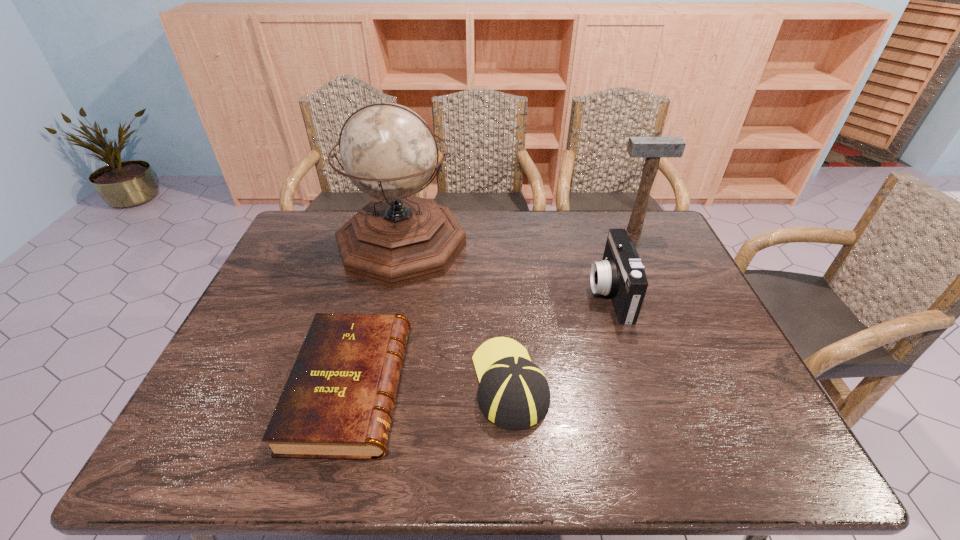
Locate an element on the screen. The image size is (960, 540). hardback book at the near edge is located at coordinates (337, 403).

You are a GUI agent. You are given a task and a screenshot of the screen. Output one action in this format:
    pyautogui.click(x=<x>, y=<y>)
    Task: Click on the object that is at the right edge
    
    Given the screenshot: What is the action you would take?
    pyautogui.click(x=652, y=148)

You are a GUI agent. You are given a task and a screenshot of the screen. Output one action in this format:
    pyautogui.click(x=<x>, y=<y>)
    Task: Click on the object at the far right corner
    This screenshot has height=540, width=960.
    Given the screenshot: What is the action you would take?
    pyautogui.click(x=652, y=148)

You are a GUI agent. You are given a task and a screenshot of the screen. Output one action in this format:
    pyautogui.click(x=<x>, y=<y>)
    Task: Click on the vacant region at the far edge of the desktop
    This screenshot has width=960, height=540.
    Given the screenshot: What is the action you would take?
    pyautogui.click(x=540, y=222)

You are a GUI agent. You are given a task and a screenshot of the screen. Output one action in this format:
    pyautogui.click(x=<x>, y=<y>)
    Task: Click on the free spot at the near edge of the desktop
    Image resolution: width=960 pixels, height=540 pixels.
    Given the screenshot: What is the action you would take?
    pyautogui.click(x=374, y=464)

Identify the location of free space at the left edge of the desktop. (226, 393).

In the image, there is a desktop. What are the coordinates of `vacant space at the right edge` in the screenshot? It's located at [x=674, y=261].

Locate an element on the screen. This screenshot has width=960, height=540. blank space at the far left corner of the desktop is located at coordinates click(x=307, y=242).

What are the coordinates of `vacant space at the far right corner of the desktop` in the screenshot? It's located at (648, 217).

This screenshot has width=960, height=540. Find the location of `vacant area between the mallet and the globe`. vacant area between the mallet and the globe is located at coordinates (517, 238).